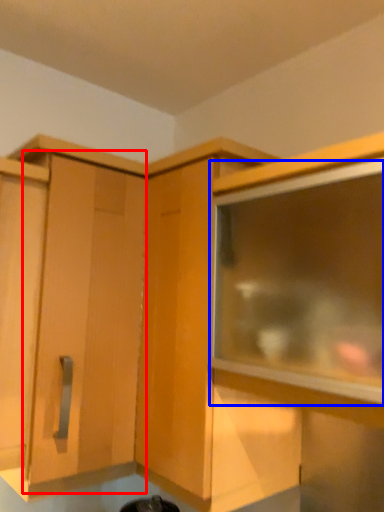
Question: Among these objects, which one is nearest to the camera, cabinetry (highlighted by a red box) or window (highlighted by a blue box)?

Choices:
 (A) cabinetry
 (B) window

Answer: (B)